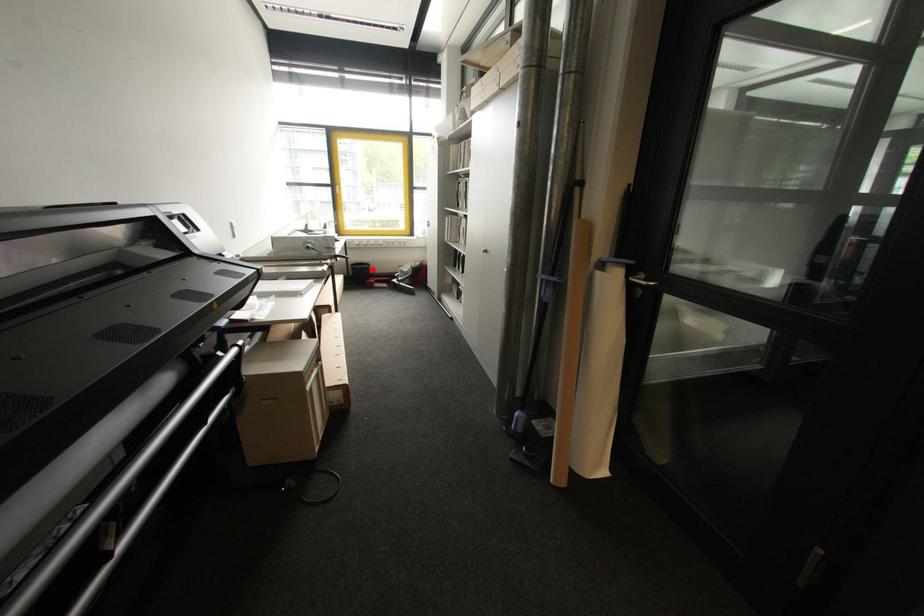
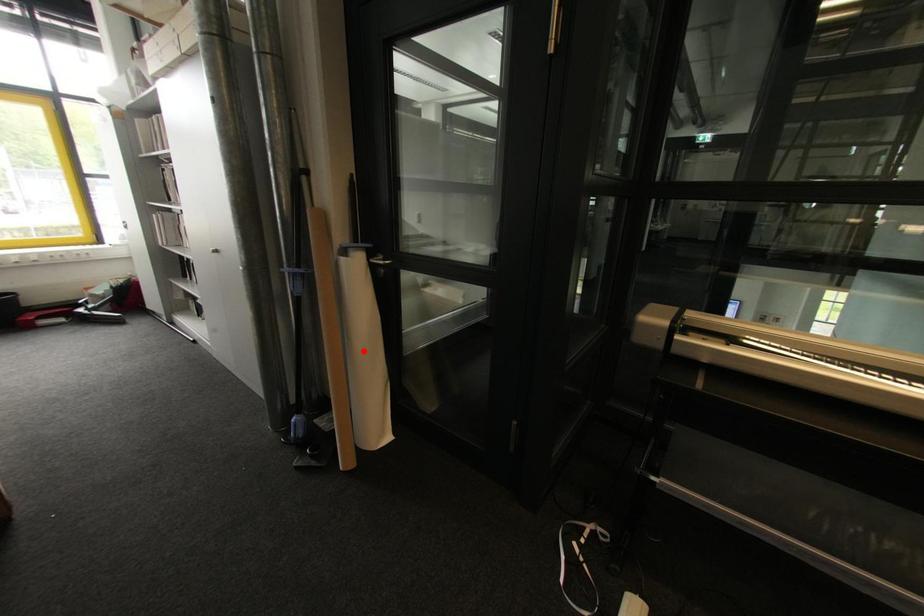
I am providing you with two images of the same scene from different viewpoints. A red point is marked on the first image and another point is marked on the second image. Is the marked point in image1 the same physical position as the marked point in image2?

No